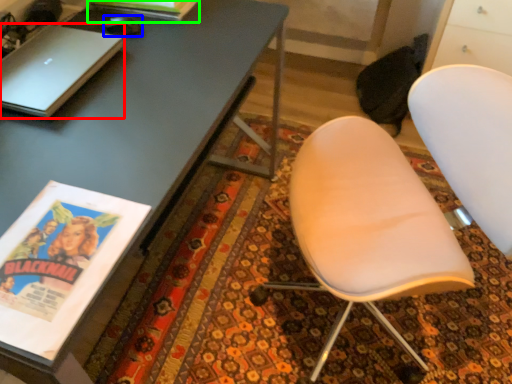
Question: Which is farther away from laptop (highlighted by a red box)? mouse (highlighted by a blue box) or magazine (highlighted by a green box)?

Choices:
 (A) mouse
 (B) magazine

Answer: (B)